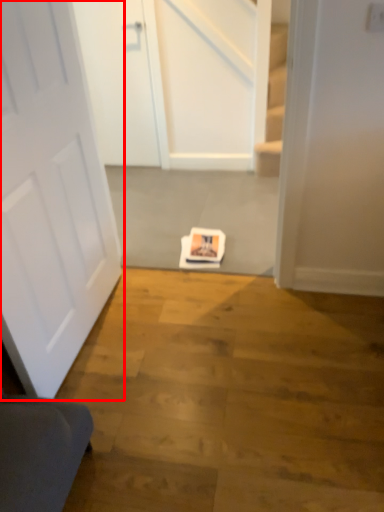
Question: Observing the image, what is the correct spatial positioning of door (annotated by the red box) in reference to door?

Choices:
 (A) right
 (B) left

Answer: (A)